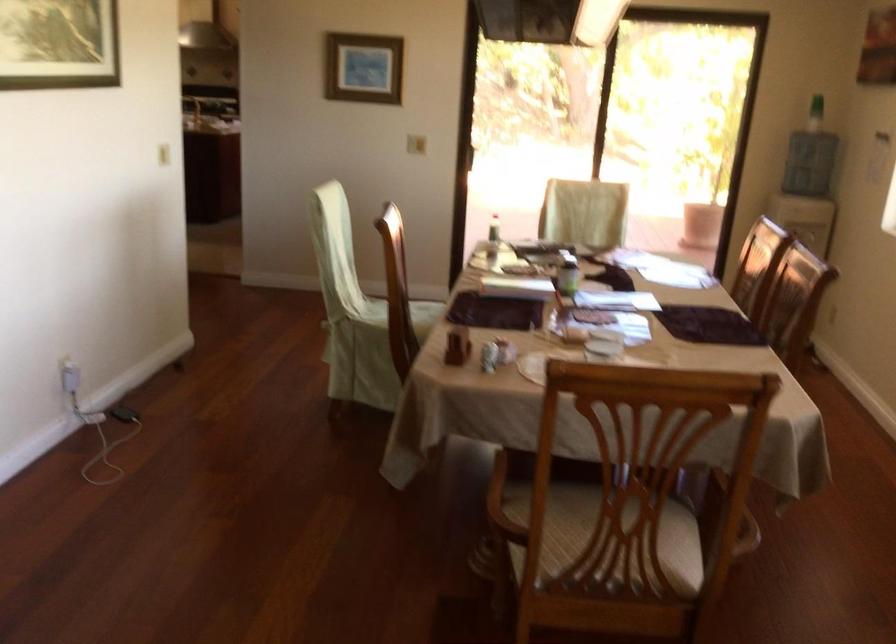
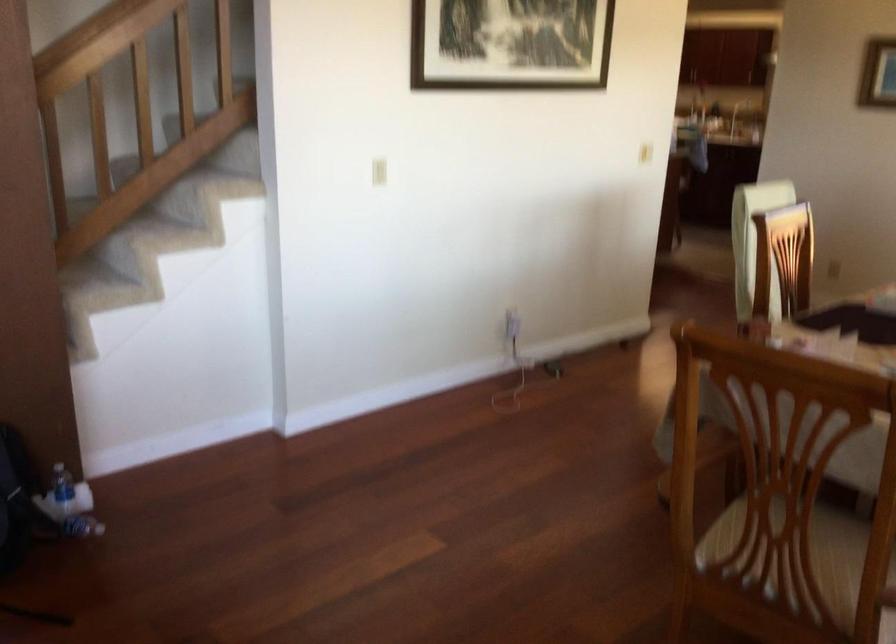
Find the pixel in the second image that matches pixel 75 373 in the first image.

(512, 324)